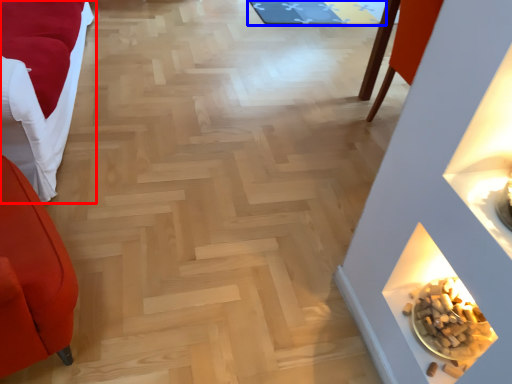
Question: Which object is closer to the camera taking this photo, furniture (highlighted by a red box) or mat (highlighted by a blue box)?

Choices:
 (A) furniture
 (B) mat

Answer: (A)